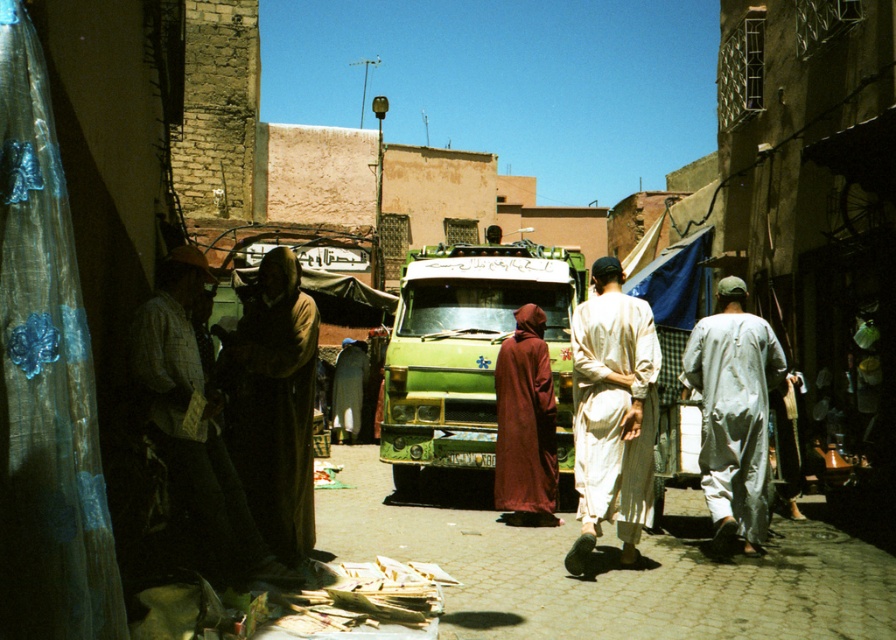
Looking at this image, you are a traveler standing on the street and see both the white cotton robe at center and the dark brown fabric at center. Which one is taller?

The dark brown fabric at center is taller than the white cotton robe at center.

You are standing in the middle of the bustling street scene. There are two points of interest marked on the ground in front of you. The first is at coordinate point (618,294) and the second is at coordinate point (210,422). Which point is closer to you?

Point (618,294) is closer to you because it is further to the viewer than point (210,422).